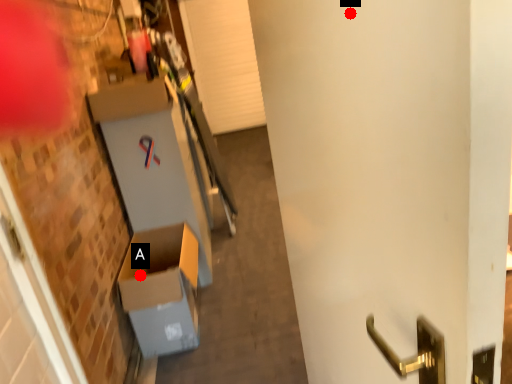
Question: Two points are circled on the image, labeled by A and B beside each circle. Among these points, which one is farthest from the camera?

Choices:
 (A) A is further
 (B) B is further

Answer: (A)